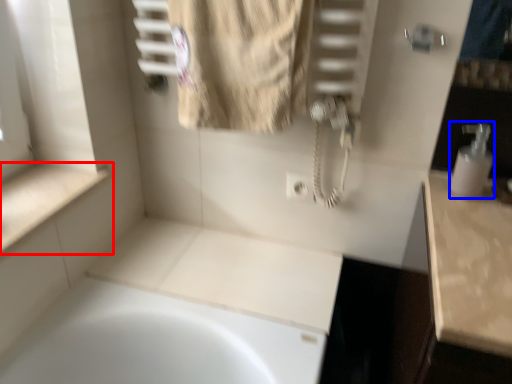
Question: Which object is closer to the camera taking this photo, counter top (highlighted by a red box) or soap dispenser (highlighted by a blue box)?

Choices:
 (A) counter top
 (B) soap dispenser

Answer: (A)